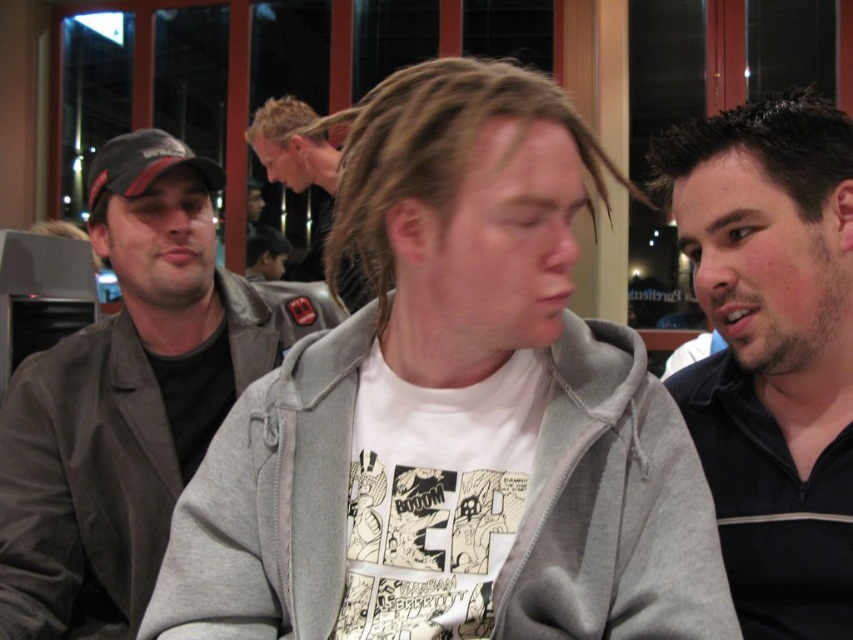
Which is in front, point (64, 538) or point (318, 250)?

Point (64, 538)

Can you confirm if dark gray jacket at left is positioned to the left of light brown hair at center?

No, dark gray jacket at left is not to the left of light brown hair at center.

Describe the element at coordinates (131, 394) in the screenshot. The width and height of the screenshot is (853, 640). I see `dark gray jacket at left` at that location.

Where is `dark gray jacket at left`? The image size is (853, 640). dark gray jacket at left is located at coordinates (131, 394).

Who is higher up, gray hoodie at center or dark gray jacket at left?

dark gray jacket at left

Between gray hoodie at center and dark gray jacket at left, which one has less height?

gray hoodie at center is shorter.

Is point (370, 532) farther from camera compared to point (196, 264)?

That is False.

Locate an element on the screen. This screenshot has width=853, height=640. gray hoodie at center is located at coordinates (451, 408).

Looking at this image, is the position of gray hoodie at center less distant than that of light brown hair at center?

Yes, it is.

Is gray hoodie at center to the left of light brown hair at center from the viewer's perspective?

No, gray hoodie at center is not to the left of light brown hair at center.

Where is `gray hoodie at center`? This screenshot has height=640, width=853. gray hoodie at center is located at coordinates (451, 408).